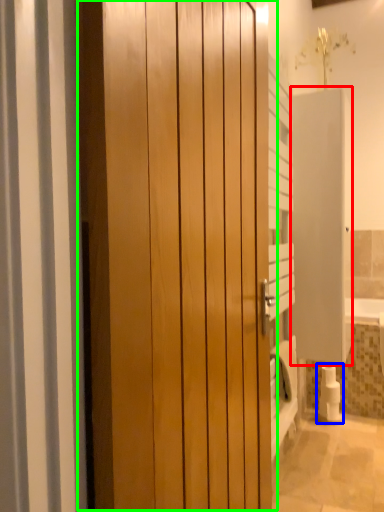
Question: Based on their relative distances, which object is nearer to screen door (highlighted by a red box)? Choose from toilet paper (highlighted by a blue box) and door (highlighted by a green box).

Choices:
 (A) toilet paper
 (B) door

Answer: (A)